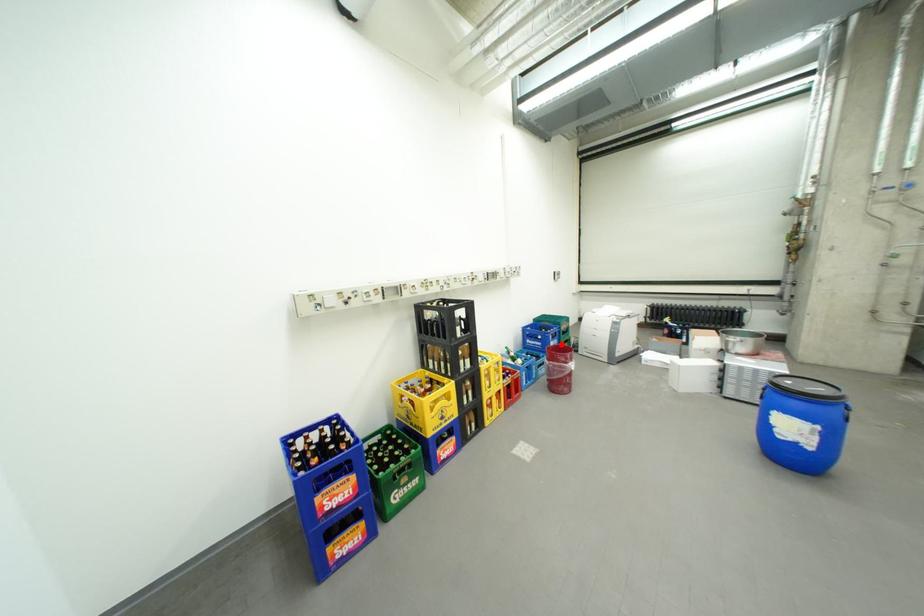
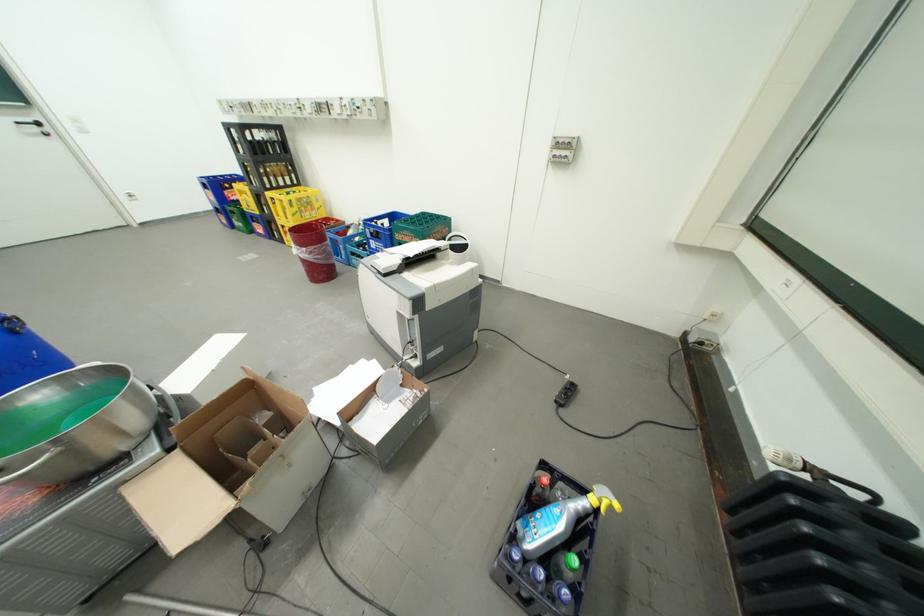
Where in the second image is the point corresponding to the highlighted location from the first image?

(381, 241)